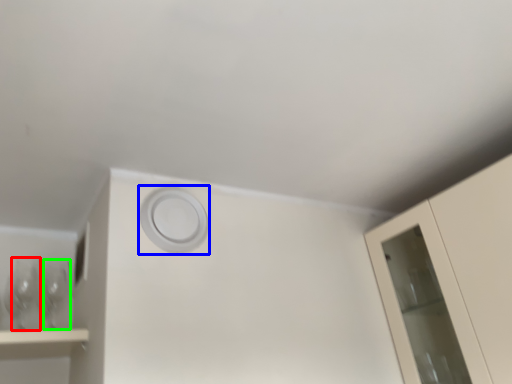
Question: Estimate the real-world distances between objects in this image. Which object is farther from wine glass (highlighted by a red box), circle (highlighted by a blue box) or wine glass (highlighted by a green box)?

Choices:
 (A) circle
 (B) wine glass

Answer: (A)